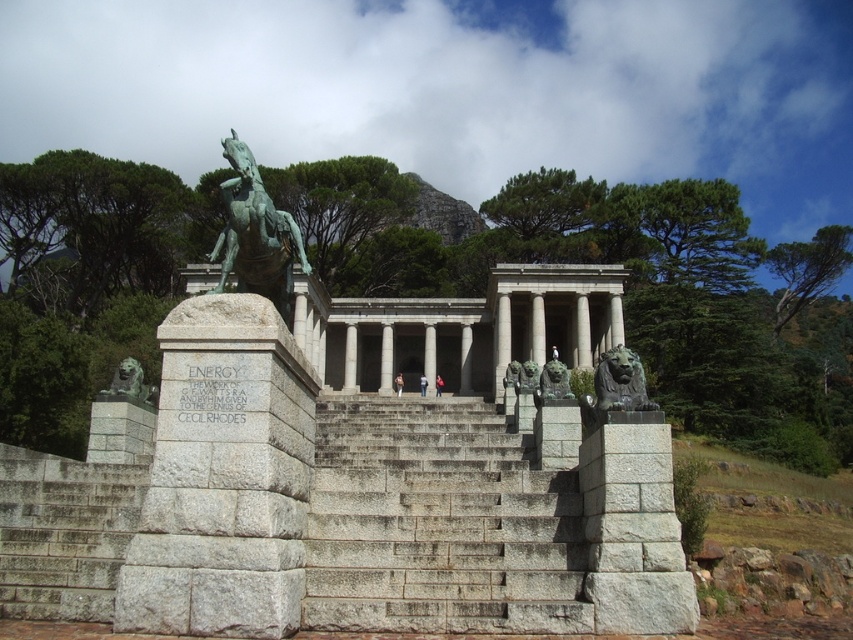
Question: Is gray stone stairs at center smaller than slate gray stone lion at lower left?

Choices:
 (A) no
 (B) yes

Answer: (A)

Question: Does gray stone stairs at center come behind bronze lion at right?

Choices:
 (A) yes
 (B) no

Answer: (B)

Question: Which object is positioned closest to the green patina metal horse at upper center?

Choices:
 (A) slate gray stone lion at lower left
 (B) gray stone pillar at center

Answer: (B)

Question: Can you confirm if bronze/statue at right is thinner than light brown leather jacket at center?

Choices:
 (A) yes
 (B) no

Answer: (B)

Question: Which object is the closest to the bronze lion at right?

Choices:
 (A) green patina metal horse at upper center
 (B) gray stone stairs at center
 (C) gray stone pillar at center

Answer: (B)

Question: Which point appears farthest from the camera in this image?

Choices:
 (A) (561, 392)
 (B) (149, 396)
 (C) (227, 252)
 (D) (614, 358)

Answer: (B)